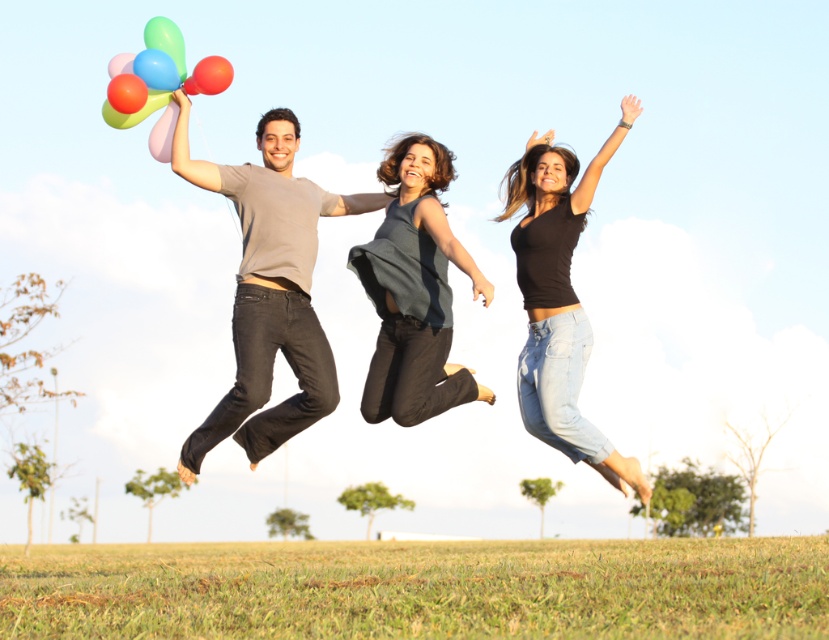
Between matte gray t-shirt at left and dark gray sleeveless top at center, which one has more height?

matte gray t-shirt at left

From the picture: Is matte gray t-shirt at left thinner than dark gray sleeveless top at center?

No.

Who is more distant from viewer, (306, 200) or (410, 163)?

The point (306, 200) is behind.

What are the coordinates of `matte gray t-shirt at left` in the screenshot? It's located at (268, 289).

Which of these two, green grassy field at lower center or dark gray sleeveless top at center, stands taller?

green grassy field at lower center is taller.

Locate an element on the screen. green grassy field at lower center is located at coordinates (419, 588).

Between matte gray t-shirt at left and black denim jeans at center, which one appears on the right side from the viewer's perspective?

black denim jeans at center

Locate an element on the screen. matte gray t-shirt at left is located at coordinates (x=268, y=289).